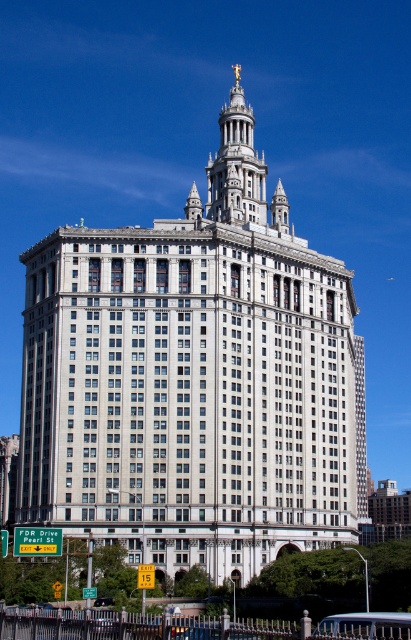
You are standing in front of the grand building and want to locate the white stone tower at upper center. Based on the scene, where would you look relative to the white stone building at center?

The white stone tower at upper center is located above the white stone building at center, so you should look upward from the white stone building at center to find the white stone tower at upper center.

Based on the photo, you are an architect evaluating the proportions of the white stone building at center and the white stone tower at upper center in the image. Which structure has a greater height?

The white stone building at center has a greater height compared to the white stone tower at upper center, so the building is taller than the tower.